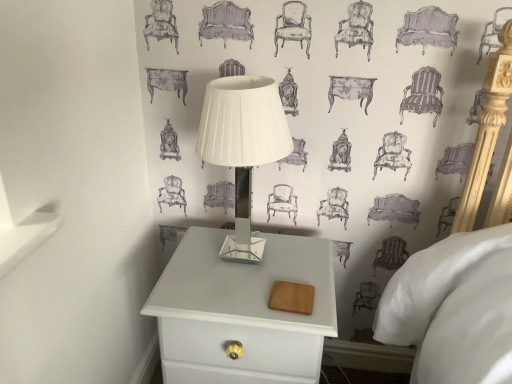
Where is `free spot above white matte nightstand at lower center (from a real-world perspective)`? free spot above white matte nightstand at lower center (from a real-world perspective) is located at coordinates (247, 271).